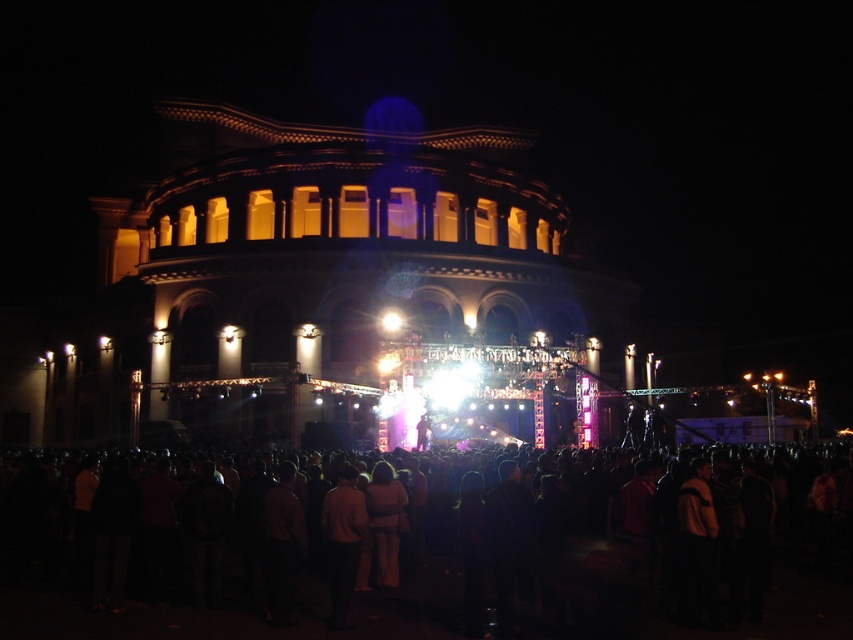
Can you confirm if dark clothing crowd at lower center is positioned to the left of light brown leather jacket at center?

Incorrect, dark clothing crowd at lower center is not on the left side of light brown leather jacket at center.

Is dark clothing crowd at lower center thinner than light brown leather jacket at center?

No.

Who is more forward, (x=560, y=528) or (x=358, y=499)?

Point (x=358, y=499) is in front.

Find the location of `dark clothing crowd at lower center`. dark clothing crowd at lower center is located at coordinates (469, 556).

Can you confirm if light brown leather jacket at center is positioned to the right of light brown fabric pants at center?

No, light brown leather jacket at center is not to the right of light brown fabric pants at center.

Is light brown leather jacket at center bigger than light brown fabric pants at center?

Indeed, light brown leather jacket at center has a larger size compared to light brown fabric pants at center.

Who is more forward, (323, 536) or (396, 552)?

Positioned in front is point (323, 536).

Locate an element on the screen. light brown leather jacket at center is located at coordinates (341, 541).

Can you confirm if dark clothing crowd at lower center is positioned below light brown fabric pants at center?

Incorrect, dark clothing crowd at lower center is not positioned below light brown fabric pants at center.

Between point (459, 508) and point (392, 570), which one is positioned behind?

Point (459, 508)

Consider the image. Who is more distant from viewer, [828,579] or [390,525]?

The point [828,579] is more distant.

The width and height of the screenshot is (853, 640). Find the location of `dark clothing crowd at lower center`. dark clothing crowd at lower center is located at coordinates (469, 556).